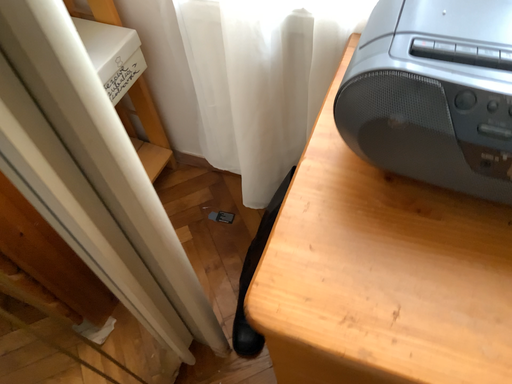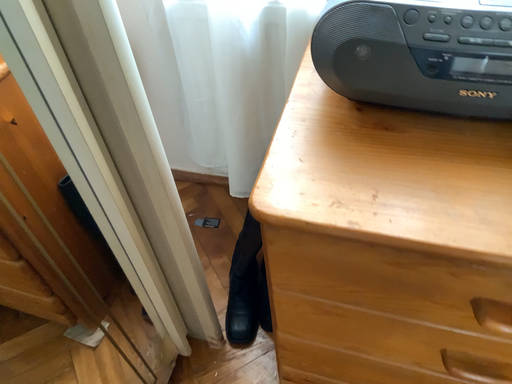
Question: Which way did the camera rotate in the video?

Choices:
 (A) rotated downward
 (B) rotated upward

Answer: (B)